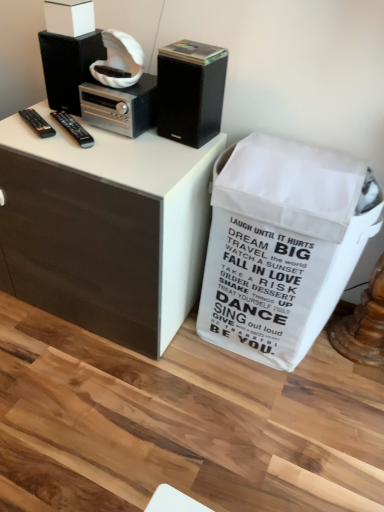
Question: Does white matte box at upper left contain black matte speaker at upper left, which is the 1th loudspeaker in left-to-right order?

Choices:
 (A) yes
 (B) no

Answer: (B)

Question: Can you confirm if white matte box at upper left is taller than black matte speaker at upper left, which is the 1th loudspeaker in left-to-right order?

Choices:
 (A) yes
 (B) no

Answer: (B)

Question: Does white matte box at upper left appear on the left side of black matte speaker at upper left, which is the 1th loudspeaker in left-to-right order?

Choices:
 (A) yes
 (B) no

Answer: (B)

Question: Is white matte box at upper left not close to black matte speaker at upper left, which is the 1th loudspeaker in left-to-right order?

Choices:
 (A) no
 (B) yes

Answer: (A)

Question: From a real-world perspective, is white matte box at upper left below black matte speaker at upper left, which is the 1th loudspeaker in left-to-right order?

Choices:
 (A) no
 (B) yes

Answer: (A)

Question: From a real-world perspective, is white matte box at upper left on top of black matte speaker at upper left, which is the second loudspeaker from right to left?

Choices:
 (A) no
 (B) yes

Answer: (B)

Question: Does black plastic remote at left, arranged as the first remote control when viewed from the left, have a greater width compared to black plastic remote at left, which is counted as the first remote control, starting from the right?

Choices:
 (A) no
 (B) yes

Answer: (A)

Question: Considering the relative positions of black plastic remote at left, the 2th remote control from the right, and black plastic remote at left, which is counted as the first remote control, starting from the right, in the image provided, is black plastic remote at left, the 2th remote control from the right, to the right of black plastic remote at left, which is counted as the first remote control, starting from the right, from the viewer's perspective?

Choices:
 (A) no
 (B) yes

Answer: (A)

Question: From the image's perspective, is black plastic remote at left, arranged as the first remote control when viewed from the left, on black plastic remote at left, which is counted as the first remote control, starting from the right?

Choices:
 (A) no
 (B) yes

Answer: (B)

Question: Is black plastic remote at left, the 2th remote control from the right, beside black plastic remote at left, which is counted as the first remote control, starting from the right?

Choices:
 (A) no
 (B) yes

Answer: (B)

Question: From the image's perspective, does black plastic remote at left, the 2th remote control from the right, appear lower than black plastic remote at left, which is counted as the first remote control, starting from the right?

Choices:
 (A) yes
 (B) no

Answer: (B)

Question: Is black plastic remote at left, arranged as the first remote control when viewed from the left, behind black plastic remote at left, which is counted as the first remote control, starting from the right?

Choices:
 (A) yes
 (B) no

Answer: (A)

Question: From the image's perspective, is black plastic remote at left, which is counted as the first remote control, starting from the right, above white matte box at upper left?

Choices:
 (A) no
 (B) yes

Answer: (A)